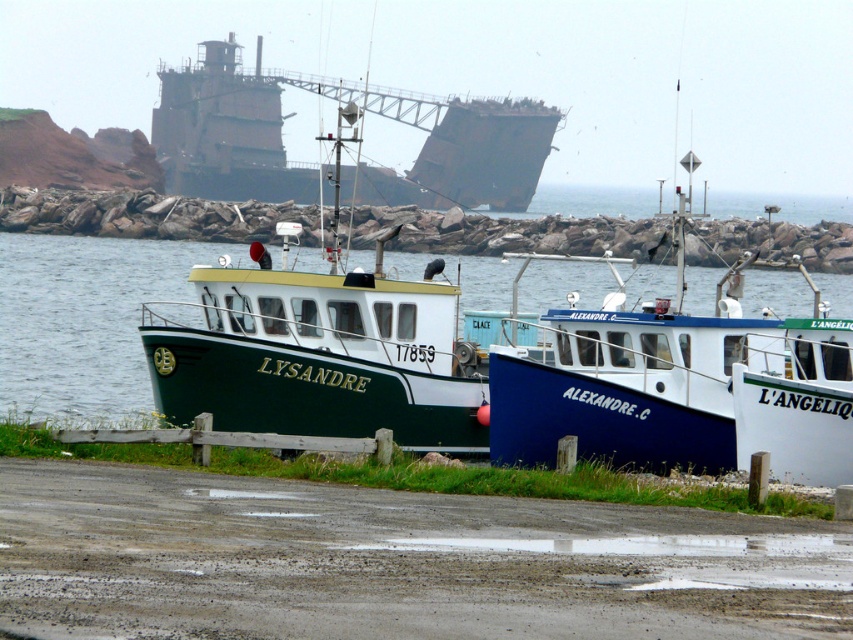
Does damp gray mud at lower center appear under green matte boat at center?

Correct, damp gray mud at lower center is located below green matte boat at center.

Is point (142, 620) positioned behind point (354, 371)?

No, it is in front of (354, 371).

Is point (805, 582) less distant than point (314, 406)?

Yes, it is in front of point (314, 406).

I want to click on damp gray mud at lower center, so click(x=393, y=563).

Between green matte boat at center and green matte water at center, which one has more height?

With more height is green matte boat at center.

Which is below, green matte boat at center or green matte water at center?

green matte water at center is lower down.

Which is behind, point (389, 308) or point (138, 339)?

The point (138, 339) is more distant.

Identify the location of green matte boat at center. (320, 353).

Between damp gray mud at lower center and green matte water at center, which one appears on the right side from the viewer's perspective?

Positioned to the right is damp gray mud at lower center.

Can you confirm if damp gray mud at lower center is taller than green matte water at center?

No.

What do you see at coordinates (393, 563) in the screenshot? The height and width of the screenshot is (640, 853). I see `damp gray mud at lower center` at bounding box center [393, 563].

Image resolution: width=853 pixels, height=640 pixels. Identify the location of damp gray mud at lower center. (393, 563).